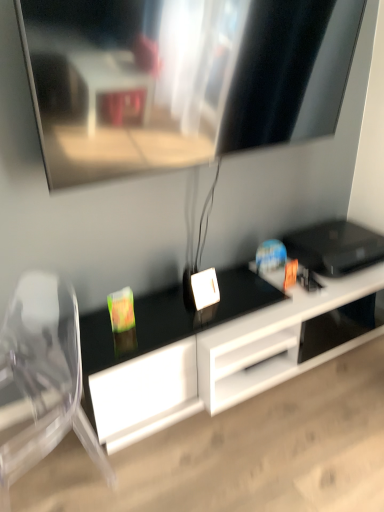
The height and width of the screenshot is (512, 384). What are the coordinates of `vacant space that's between black glossy desk at center and transparent plastic swivel chair at left` in the screenshot? It's located at (218, 434).